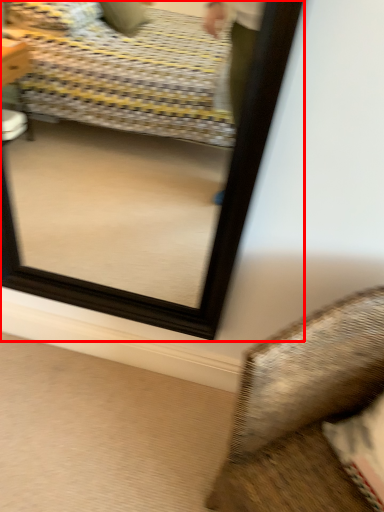
Question: Considering the relative positions of mirror (annotated by the red box) and furniture in the image provided, where is mirror (annotated by the red box) located with respect to the staircase?

Choices:
 (A) right
 (B) left

Answer: (B)